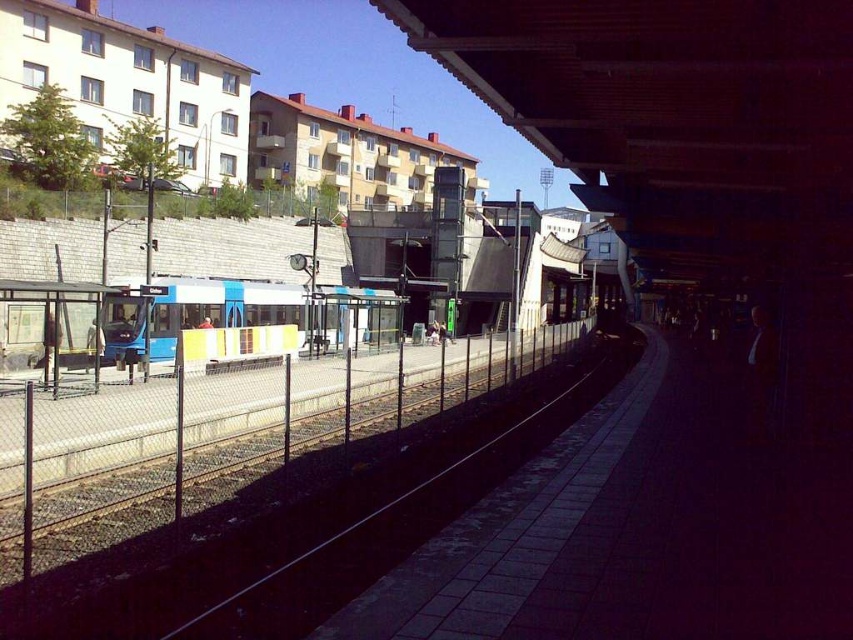
You are a delivery person carrying a large package that is 1.5 meters wide. You need to pass through either the metal mesh fence at left or the transparent plastic bus stop at left. Based on their sizes, which one can you pass through without needing to adjust your package?

The metal mesh fence at left is bigger than the transparent plastic bus stop at left, so the metal mesh fence at left can accommodate the 1.5 meter wide package without needing adjustments.

You are a maintenance worker needing to reach the blue metallic train at center from your current position near the metal mesh fence at left. The path between them is clear. Given that your tool cart is 1.2 meters wide, can you safely navigate the 8.08 meters distance without obstruction?

The distance between the metal mesh fence at left and the blue metallic train at center is 8.08 meters. Since the path is clear and your tool cart is only 1.2 meters wide, which is narrower than the available space, you can safely navigate the 8.08 meters distance without obstruction.